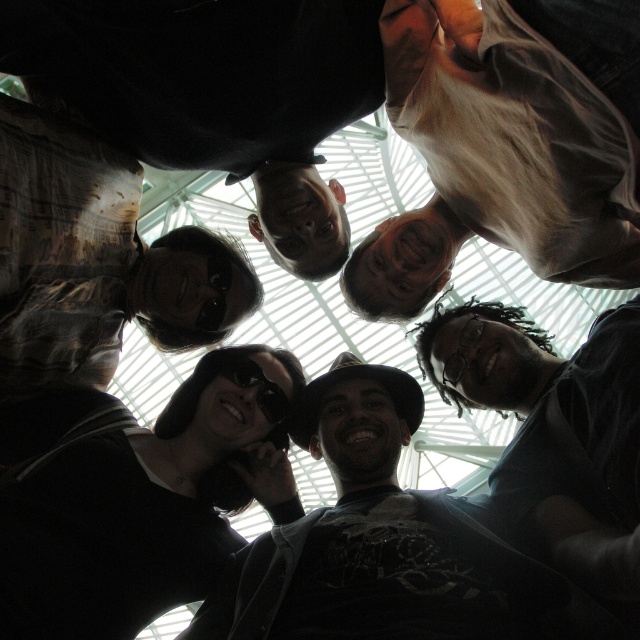
Can you confirm if light brown shirt at upper right is positioned below dark gray shirt at center?

Actually, light brown shirt at upper right is above dark gray shirt at center.

Which is behind, point (566, 22) or point (556, 529)?

The point (556, 529) is more distant.

Between point (579, 13) and point (556, 518), which one is positioned behind?

Point (556, 518)

Find the location of a particular element. light brown shirt at upper right is located at coordinates (508, 145).

Can you confirm if matte black shirt at center is shorter than dark gray shirt at center?

In fact, matte black shirt at center may be taller than dark gray shirt at center.

Can you confirm if matte black shirt at center is wider than dark gray shirt at center?

Correct, the width of matte black shirt at center exceeds that of dark gray shirt at center.

Between point (292, 538) and point (509, 376), which one is positioned behind?

The point (509, 376) is behind.

Locate an element on the screen. The width and height of the screenshot is (640, 640). matte black shirt at center is located at coordinates (380, 541).

Does point (552, 157) come farther from viewer compared to point (445, 588)?

No, it is not.

Does point (448, 109) lie in front of point (349, 616)?

No, (448, 109) is behind (349, 616).

Find the location of `light brown shirt at upper right`. light brown shirt at upper right is located at coordinates (508, 145).

You are a GUI agent. You are given a task and a screenshot of the screen. Output one action in this format:
    pyautogui.click(x=<x>, y=<y>)
    Task: Click on the light brown shirt at upper right
    The width and height of the screenshot is (640, 640).
    Given the screenshot: What is the action you would take?
    pyautogui.click(x=508, y=145)